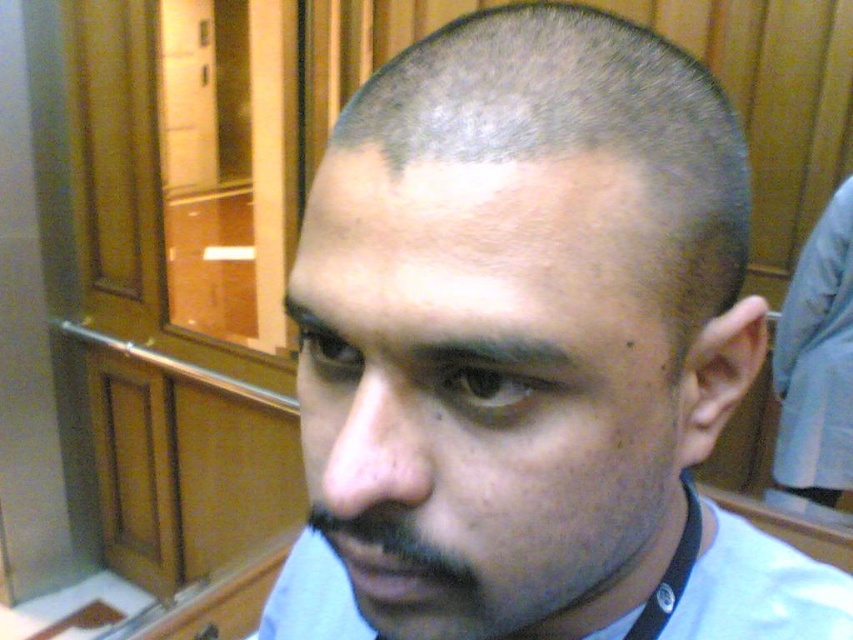
Question: Is gray matte hair at upper center closer to camera compared to black fabric neckband at lower right?

Choices:
 (A) no
 (B) yes

Answer: (B)

Question: Which object is farther from the camera taking this photo?

Choices:
 (A) black fabric neckband at lower right
 (B) light blue fabric dress shirt at right

Answer: (B)

Question: Which object appears farthest from the camera in this image?

Choices:
 (A) gray matte hair at upper center
 (B) black fabric neckband at lower right
 (C) light blue shirt at center
 (D) light blue fabric dress shirt at right

Answer: (D)

Question: Estimate the real-world distances between objects in this image. Which object is closer to the light blue shirt at center?

Choices:
 (A) black fabric neckband at lower right
 (B) light blue fabric dress shirt at right
 (C) gray matte hair at upper center

Answer: (C)

Question: Can you confirm if light blue shirt at center is thinner than black fabric neckband at lower right?

Choices:
 (A) no
 (B) yes

Answer: (A)

Question: Does gray matte hair at upper center appear over black fabric neckband at lower right?

Choices:
 (A) no
 (B) yes

Answer: (B)